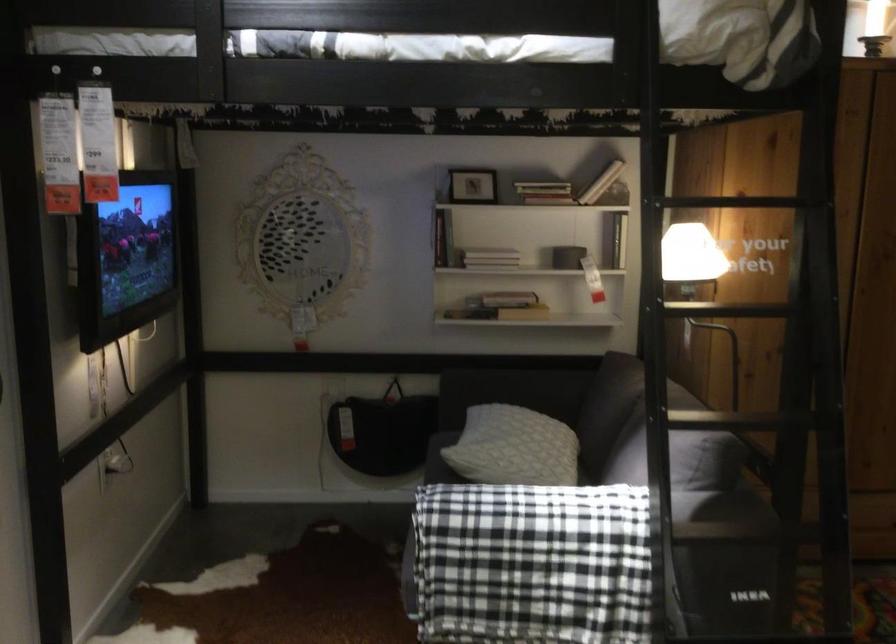
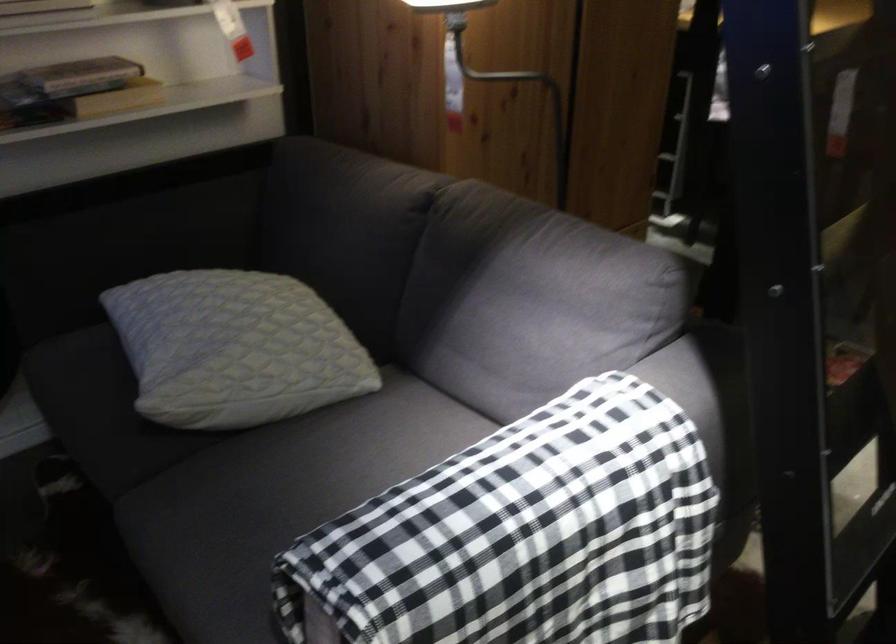
In the second image, find the point that corresponds to (x=504, y=442) in the first image.

(234, 348)